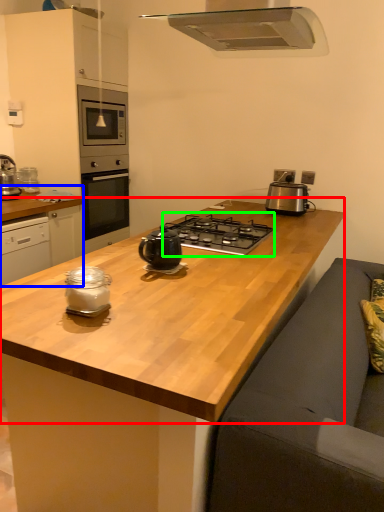
Question: Which object is positioned closest to countertop (highlighted by a red box)? Select from cabinetry (highlighted by a blue box) and gas stove (highlighted by a green box).

Choices:
 (A) cabinetry
 (B) gas stove

Answer: (B)